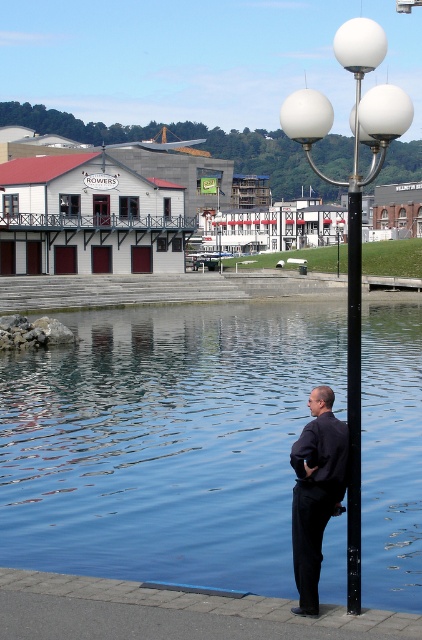
Question: Which of the following is the closest to the observer?

Choices:
 (A) white glossy streetlight at right
 (B) white glossy lamp post at upper center
 (C) blue smooth water at center
 (D) black smooth shirt at center

Answer: (D)

Question: Which of the following is the farthest from the observer?

Choices:
 (A) (319, 536)
 (B) (232, 442)
 (C) (349, 241)

Answer: (B)

Question: From the image, what is the correct spatial relationship of black smooth shirt at center in relation to white glossy streetlight at right?

Choices:
 (A) left
 (B) right

Answer: (A)

Question: Which point is farther to the camera?

Choices:
 (A) (324, 500)
 (B) (375, 572)
 (C) (356, 472)

Answer: (B)

Question: Does white glossy lamp post at upper center appear on the left side of white glossy streetlight at right?

Choices:
 (A) yes
 (B) no

Answer: (B)

Question: Can you confirm if white glossy lamp post at upper center is bigger than white glossy streetlight at right?

Choices:
 (A) yes
 (B) no

Answer: (A)